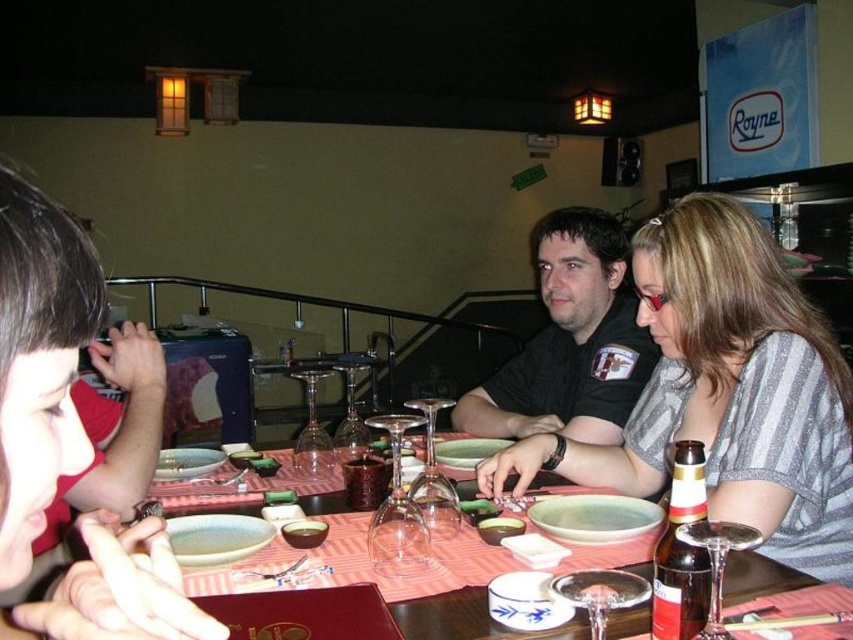
Question: Is striped fabric shirt at center behind black matte shirt at center?

Choices:
 (A) yes
 (B) no

Answer: (B)

Question: Which is farther from the striped fabric shirt at center?

Choices:
 (A) smooth ceramic bowl at center
 (B) black matte shirt at center
 (C) smooth porcelain bowl at center
 (D) brown glass bottle at right

Answer: (D)

Question: Which object appears farthest from the camera in this image?

Choices:
 (A) striped fabric shirt at center
 (B) smooth ceramic bowl at center

Answer: (B)

Question: Does brown glass bottle at right have a smaller size compared to smooth porcelain bowl at center?

Choices:
 (A) no
 (B) yes

Answer: (A)

Question: Does black matte shirt at center have a greater width compared to smooth ceramic bowl at center?

Choices:
 (A) yes
 (B) no

Answer: (A)

Question: Which point is closer to the camera taking this photo?

Choices:
 (A) (463, 449)
 (B) (704, 278)
 (C) (561, 230)
 (D) (608, 502)

Answer: (D)